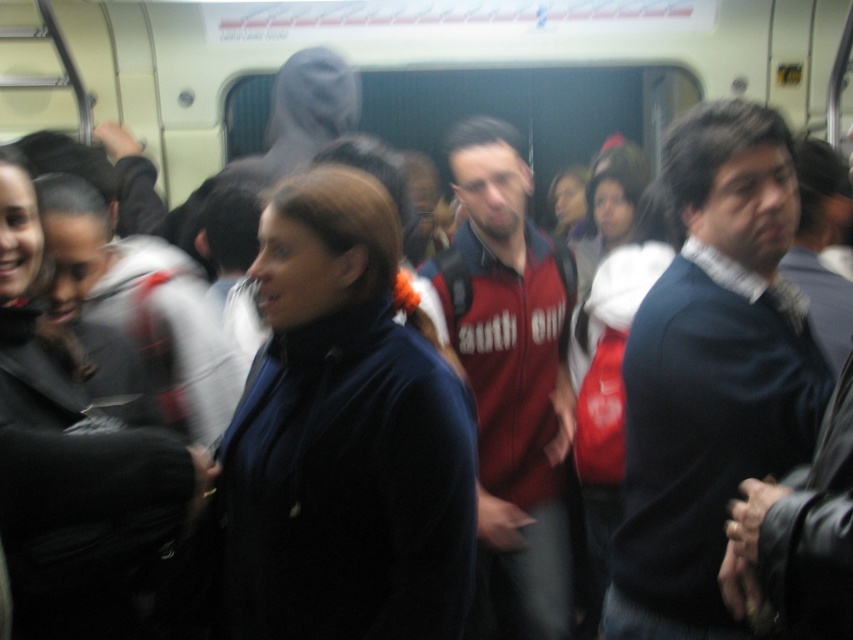
Question: Which of the following is the farthest from the observer?

Choices:
 (A) velvet blue jacket at center
 (B) dark blue sweater at center
 (C) red fabric jacket at center

Answer: (C)

Question: Observing the image, what is the correct spatial positioning of dark blue sweater at center in reference to red fabric jacket at center?

Choices:
 (A) below
 (B) above

Answer: (B)

Question: Among these points, which one is nearest to the camera?

Choices:
 (A) (78, 604)
 (B) (653, 326)
 (C) (291, 458)
 (D) (514, 632)

Answer: (A)

Question: Which object is the farthest from the dark blue sweater at center?

Choices:
 (A) red fabric jacket at center
 (B) matte black jacket at center

Answer: (B)

Question: Is velvet blue jacket at center to the right of matte black jacket at center from the viewer's perspective?

Choices:
 (A) yes
 (B) no

Answer: (A)

Question: Is dark blue sweater at center to the left of matte black jacket at center from the viewer's perspective?

Choices:
 (A) yes
 (B) no

Answer: (B)